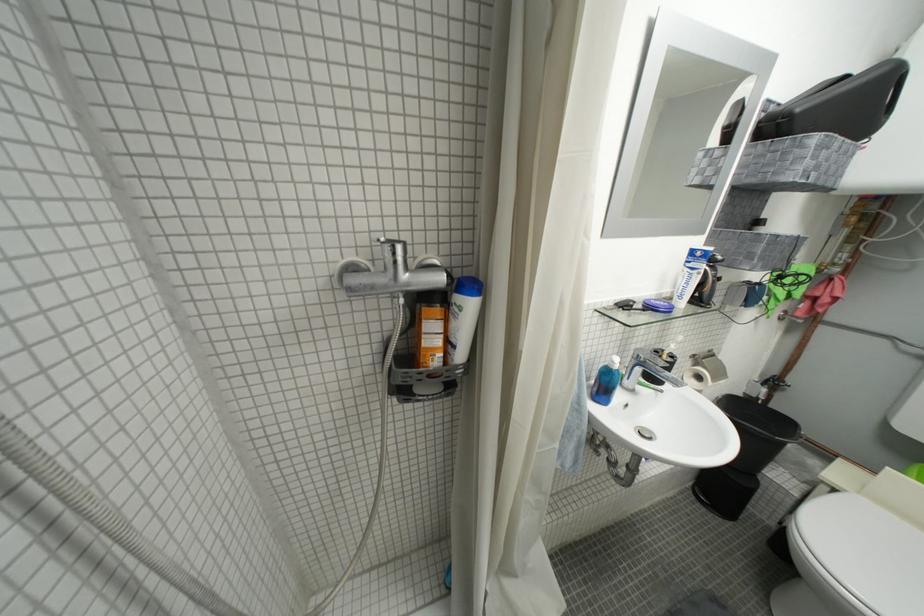
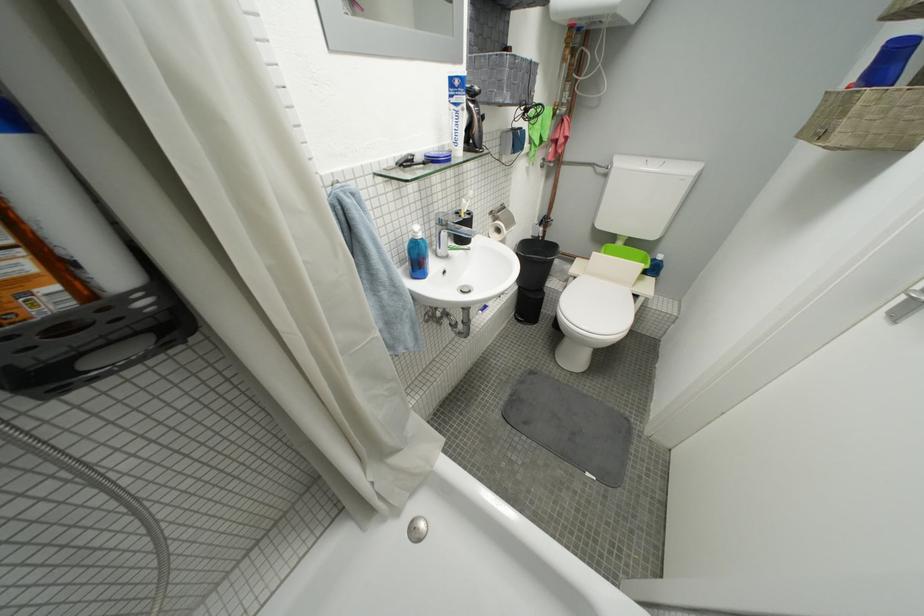
Locate, in the second image, the point that corresponds to [618,385] in the first image.

(428, 257)